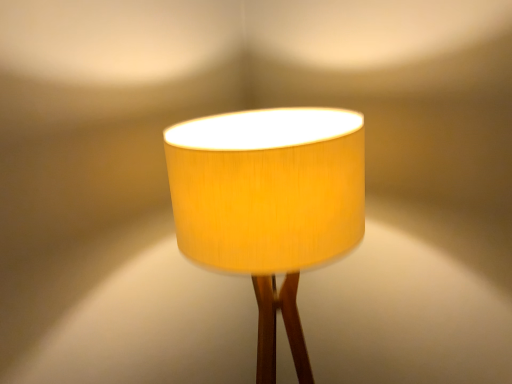
Question: Should I look upward or downward to see matte yellow fabric lampshade at center?

Choices:
 (A) down
 (B) up

Answer: (A)